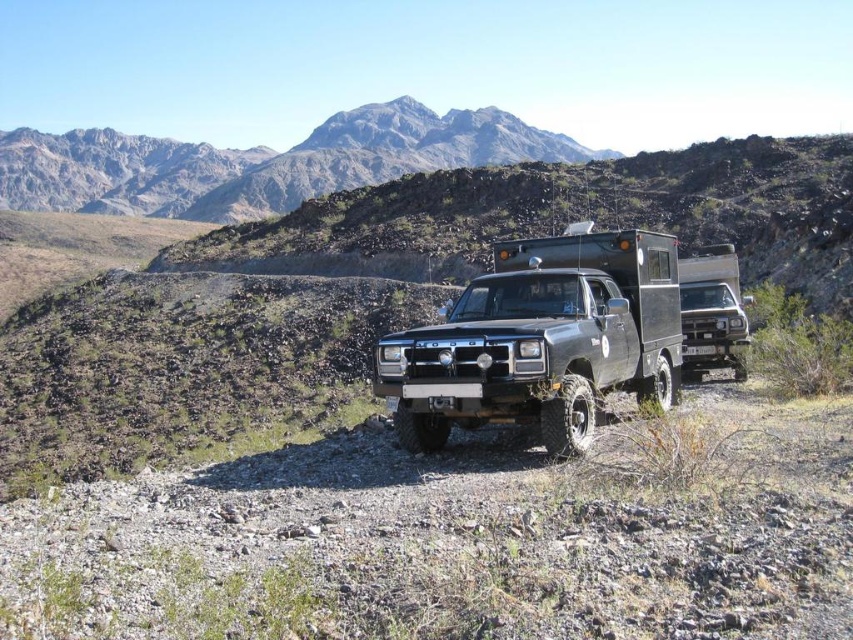
Question: Does black matte truck at center appear over matte black truck at right?

Choices:
 (A) yes
 (B) no

Answer: (B)

Question: Is rugged granite mountain at upper center positioned before matte black truck at right?

Choices:
 (A) no
 (B) yes

Answer: (A)

Question: Which of the following is the farthest from the observer?

Choices:
 (A) black matte truck at center
 (B) rugged granite mountain at upper center

Answer: (B)

Question: Is black matte truck at center in front of rugged granite mountain at upper center?

Choices:
 (A) yes
 (B) no

Answer: (A)

Question: Among these points, which one is farthest from the camera?

Choices:
 (A) (431, 148)
 (B) (689, 276)

Answer: (A)

Question: Which of the following is the closest to the observer?

Choices:
 (A) rugged granite mountain at upper center
 (B) matte black truck at right
 (C) black matte truck at center

Answer: (C)